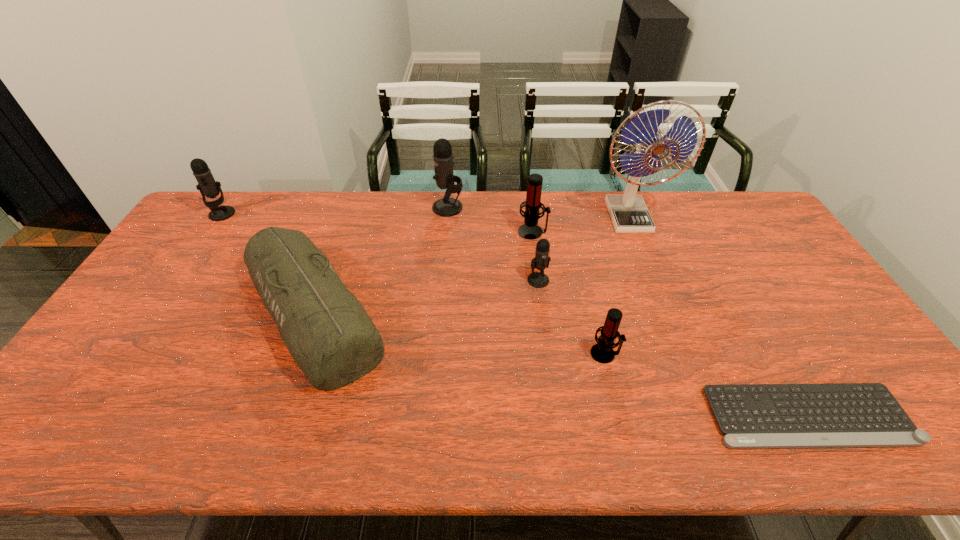
At what (x,y) coordinates should I click in order to perform the action: click on the nearest black microphone. Please return your answer as a coordinate pair (x, y). Image resolution: width=960 pixels, height=540 pixels. Looking at the image, I should click on (541, 261).

What are the coordinates of `the fourth farthest microphone` in the screenshot? It's located at (541, 261).

Where is `the right red microphone`? The image size is (960, 540). the right red microphone is located at coordinates (602, 352).

Image resolution: width=960 pixels, height=540 pixels. Find the location of `the sixth object from left to right`. the sixth object from left to right is located at coordinates (602, 352).

Image resolution: width=960 pixels, height=540 pixels. What are the coordinates of `the shortest object` in the screenshot? It's located at (839, 415).

Where is `gray computer keyboard`? This screenshot has height=540, width=960. gray computer keyboard is located at coordinates (839, 415).

Find the location of a particular element. Image resolution: width=960 pixels, height=540 pixels. vacant space located on the front-facing side of the fan is located at coordinates (673, 333).

Identify the location of vacant space located on the left of the second black microphone from left to right. Image resolution: width=960 pixels, height=540 pixels. (408, 207).

Locate an element on the screen. free space located 0.400m on the front of the second smallest black microphone is located at coordinates (156, 309).

You are a GUI agent. You are given a task and a screenshot of the screen. Output one action in this format:
    pyautogui.click(x=<x>, y=<y>)
    Task: Click on the vacant point located on the left of the bigger red microphone
    This screenshot has width=960, height=540.
    Given the screenshot: What is the action you would take?
    pyautogui.click(x=503, y=232)